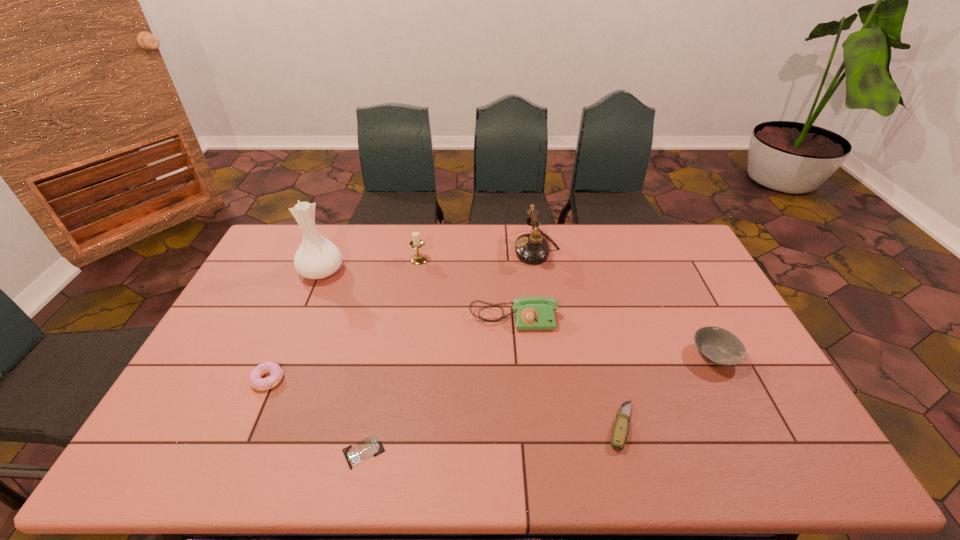
In the image, there is a desktop. Where is `vacant space at the far edge`? The width and height of the screenshot is (960, 540). vacant space at the far edge is located at coordinates (352, 253).

Locate an element on the screen. free space at the near edge is located at coordinates (228, 457).

Find the location of a particular element. vacant region at the left edge of the desktop is located at coordinates (280, 308).

Where is `free location at the right edge`? free location at the right edge is located at coordinates (698, 277).

What are the coordinates of `free space between the candle holder and the second tallest object` in the screenshot? It's located at (478, 254).

In order to click on empty space between the doughnut and the third tallest object in this screenshot , I will do `click(344, 319)`.

This screenshot has width=960, height=540. I want to click on free space between the shortest object and the tallest object, so click(x=343, y=362).

The image size is (960, 540). In order to click on vacant space in between the farther telephone and the third tallest object in this screenshot , I will do `click(478, 254)`.

At what (x,y) coordinates should I click in order to perform the action: click on empty space between the fifth tallest object and the fourth farthest object. Please return your answer as a coordinate pair (x, y). Looking at the image, I should click on (613, 338).

Locate an element on the screen. The width and height of the screenshot is (960, 540). vacant area that lies between the fifth shortest object and the fifth tallest object is located at coordinates (613, 338).